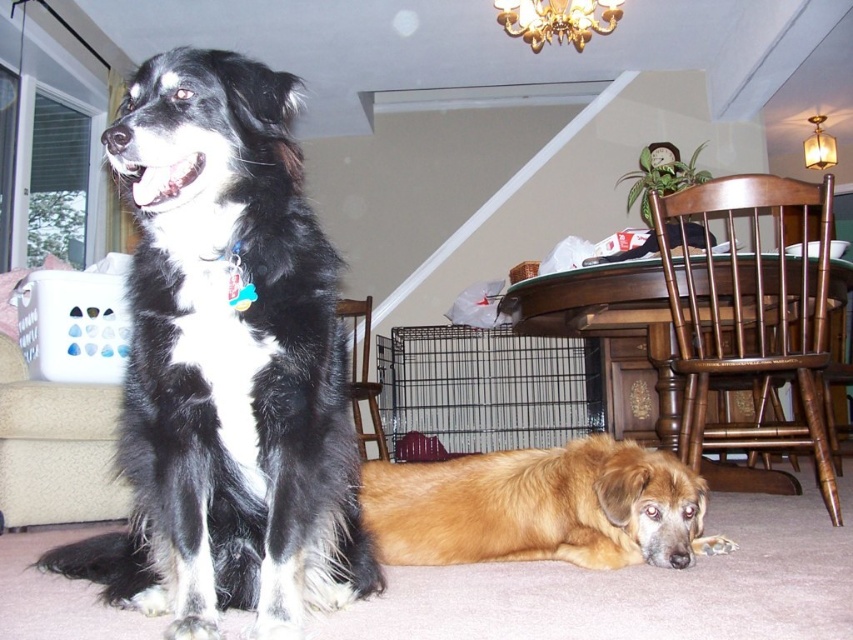
Question: Among these objects, which one is nearest to the camera?

Choices:
 (A) black wire cage at lower center
 (B) black fur dog at left

Answer: (B)

Question: In this image, where is black fur dog at left located relative to golden fur dog at lower center?

Choices:
 (A) below
 (B) above

Answer: (B)

Question: Which of these objects is positioned farthest from the black wire cage at lower center?

Choices:
 (A) golden fur dog at lower center
 (B) black fur dog at left

Answer: (B)

Question: Which of these objects is positioned closest to the golden fur dog at lower center?

Choices:
 (A) black wire cage at lower center
 (B) black fur dog at left

Answer: (B)

Question: Does black fur dog at left have a greater width compared to golden fur dog at lower center?

Choices:
 (A) no
 (B) yes

Answer: (A)

Question: Can you confirm if golden fur dog at lower center is positioned above black wire cage at lower center?

Choices:
 (A) yes
 (B) no

Answer: (B)